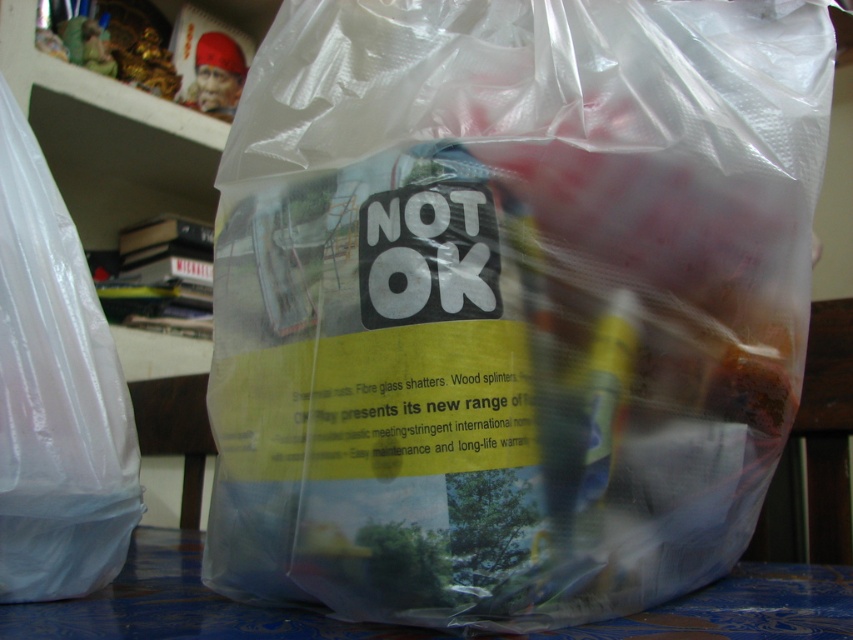
Who is more forward, (302,364) or (112,410)?

Point (302,364) is in front.

Is point (426, 340) positioned behind point (70, 273)?

No, (426, 340) is closer to viewer.

Describe the element at coordinates (509, 301) in the screenshot. The image size is (853, 640). I see `transparent plastic bag at center` at that location.

Where is `transparent plastic bag at center`? The image size is (853, 640). transparent plastic bag at center is located at coordinates (509, 301).

Does transparent plastic bag at left appear under blue fabric table at lower center?

Actually, transparent plastic bag at left is above blue fabric table at lower center.

Which is behind, point (88, 452) or point (53, 612)?

The point (88, 452) is more distant.

Which is behind, point (114, 493) or point (200, 609)?

The point (114, 493) is more distant.

Find the location of `transparent plastic bag at left`. transparent plastic bag at left is located at coordinates (55, 394).

Between transparent plastic bag at center and blue fabric table at lower center, which one has more height?

transparent plastic bag at center

Between point (438, 195) and point (157, 634), which one is positioned in front?

Positioned in front is point (157, 634).

This screenshot has height=640, width=853. I want to click on transparent plastic bag at center, so click(509, 301).